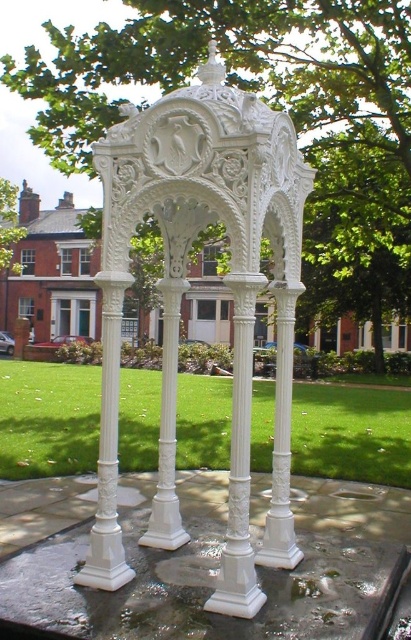
You are planning to install a new lighting system for the white carved gazebo at center and the green leafy tree at center. Which object requires taller lighting poles to accommodate its height?

The green leafy tree at center requires taller lighting poles because it is taller than the white carved gazebo at center.

You are standing at the point closest to the ornate structure in the image. There are two points marked on the ground, one at coordinates point (362, 148) and the other at point (103, 368). Which of these points is farther away from your current position?

Point (362, 148) is farther away from your current position because it is stated to be behind point (103, 368), indicating a greater distance from the observer.

You are a visitor in the park and want to take a photo of the white carved gazebo at center and the green leafy tree at center. Which object is casting a shadow on the other?

The green leafy tree at center is casting a shadow on the white carved gazebo at center because the gazebo is below the tree.